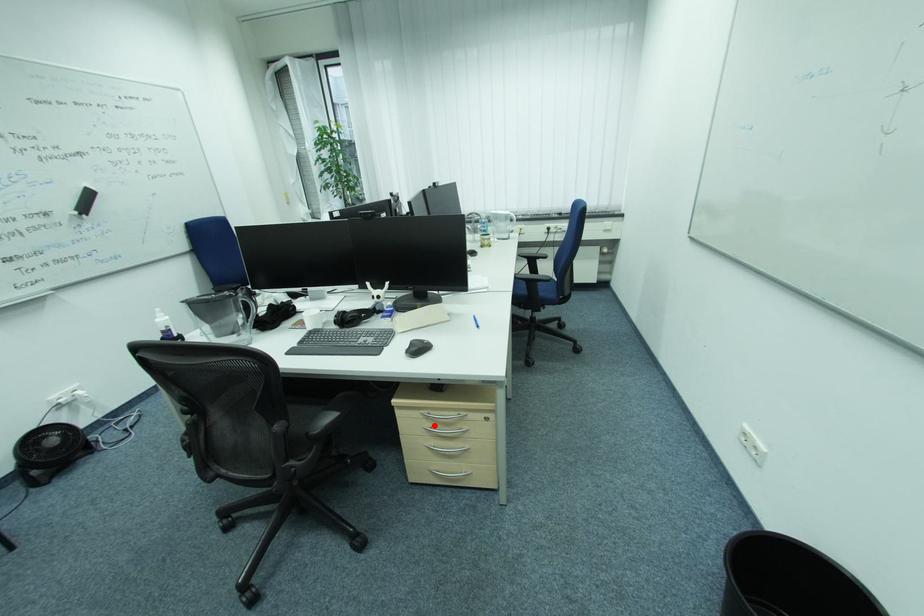
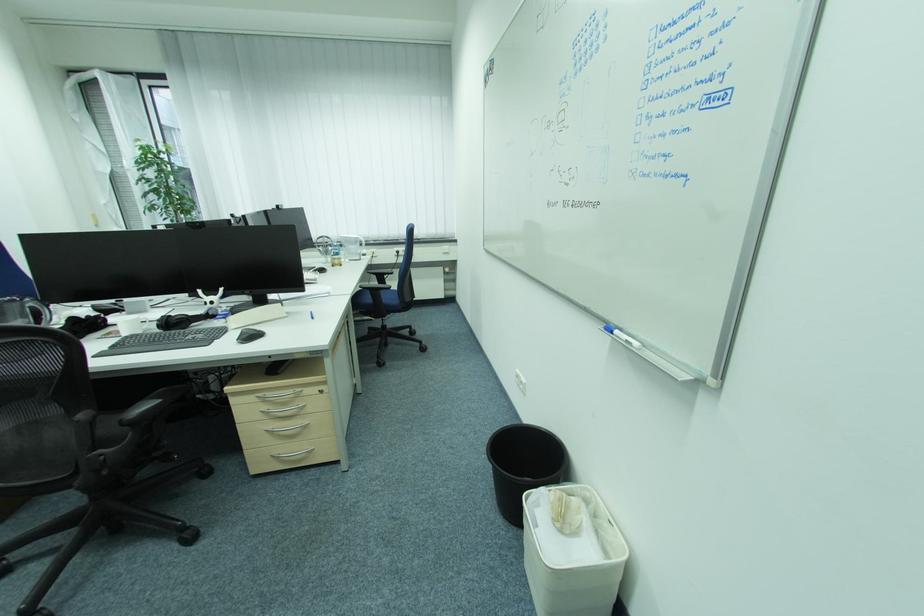
Locate, in the second image, the point that corresponds to the highlighted location in the first image.

(272, 408)